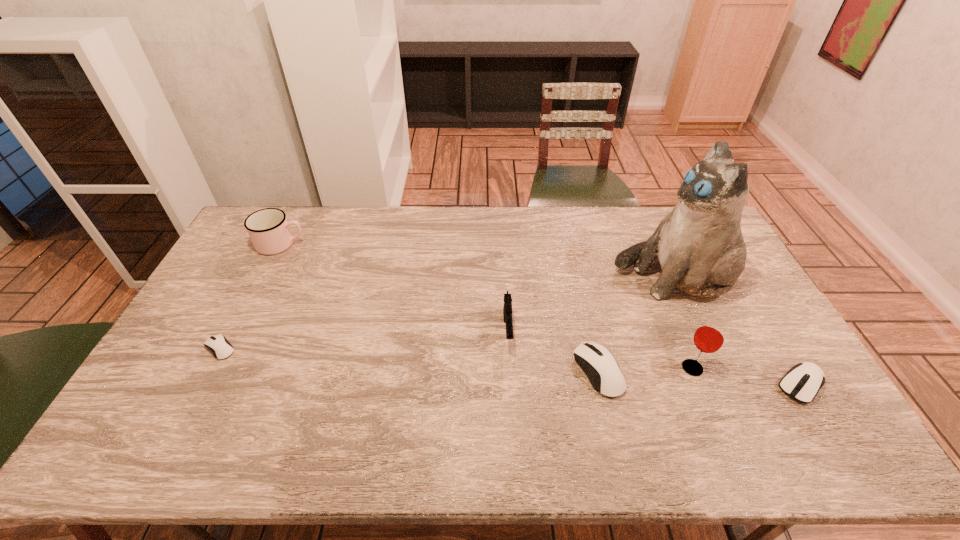
Image resolution: width=960 pixels, height=540 pixels. What are the coordinates of `mug located at the left edge` in the screenshot? It's located at (268, 228).

Identify the location of mouse positioned at the right edge. (802, 382).

Locate an element on the screen. The height and width of the screenshot is (540, 960). cat that is positioned at the right edge is located at coordinates (701, 250).

You are a GUI agent. You are given a task and a screenshot of the screen. Output one action in this format:
    pyautogui.click(x=<x>, y=<y>)
    Task: Click on the object situated at the far left corner
    Image resolution: width=960 pixels, height=540 pixels.
    Given the screenshot: What is the action you would take?
    (x=268, y=228)

The width and height of the screenshot is (960, 540). I want to click on object present at the near right corner, so 802,382.

This screenshot has height=540, width=960. In the image, there is a desktop. Find the location of `free space at the far edge`. free space at the far edge is located at coordinates (543, 243).

Find the location of `free space at the near edge of the desktop`. free space at the near edge of the desktop is located at coordinates (248, 416).

Where is `free space at the left edge of the desktop`? The image size is (960, 540). free space at the left edge of the desktop is located at coordinates (185, 381).

In the image, there is a desktop. Identify the location of vacant region at the right edge. The width and height of the screenshot is (960, 540). (760, 306).

Locate an element on the screen. blank space at the near right corner of the desktop is located at coordinates (778, 410).